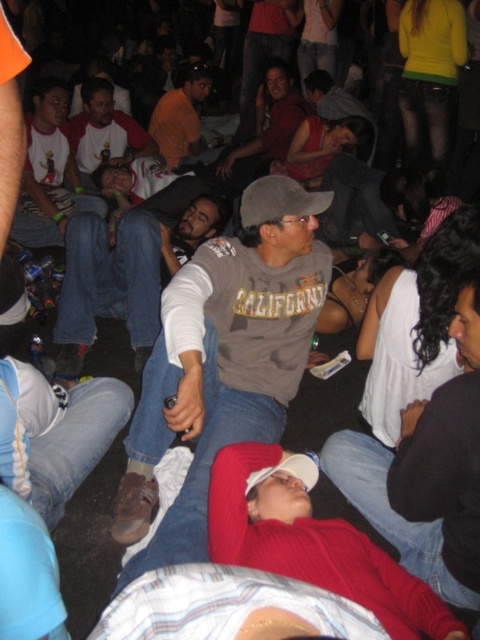
Which is in front, point (37, 97) or point (219, 140)?

Point (37, 97) is in front.

Between point (60, 147) and point (167, 145), which one is positioned in front?

Point (60, 147) is more forward.

At what (x,y) coordinates should I click in order to perform the action: click on white t-shirt at center. Please return your answer as a coordinate pair (x, y). Image resolution: width=480 pixels, height=640 pixels. Looking at the image, I should click on (49, 172).

Which is in front, point (199, 445) or point (197, 234)?

Point (199, 445) is more forward.

Is matte gray sweatshirt at center closer to the viewer compared to gray cotton shirt at center?

Yes, matte gray sweatshirt at center is in front of gray cotton shirt at center.

Who is more distant from viewer, (215, 444) or (148, 241)?

Positioned behind is point (148, 241).

This screenshot has width=480, height=640. What are the coordinates of `matte gray sweatshirt at center` in the screenshot? It's located at (228, 348).

Is matte red shirt at center in front of gray fabric baseball cap at center?

No, it is not.

Is matte red shirt at center wider than gray fabric baseball cap at center?

Indeed, matte red shirt at center has a greater width compared to gray fabric baseball cap at center.

You are a GUI agent. You are given a task and a screenshot of the screen. Output one action in this format:
    pyautogui.click(x=<x>, y=<y>)
    Task: Click on the matte red shirt at center
    Image resolution: width=480 pixels, height=640 pixels.
    Given the screenshot: What is the action you would take?
    pyautogui.click(x=271, y=120)